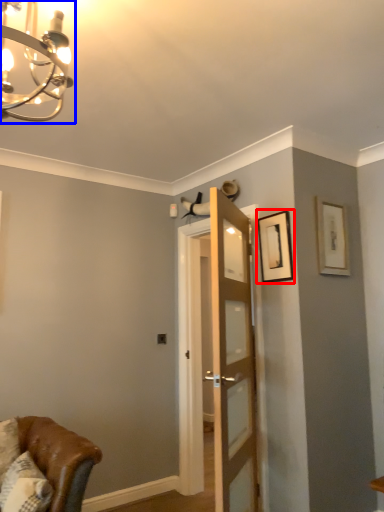
Question: Among these objects, which one is nearest to the camera, picture frame (highlighted by a red box) or light fixture (highlighted by a blue box)?

Choices:
 (A) picture frame
 (B) light fixture

Answer: (B)